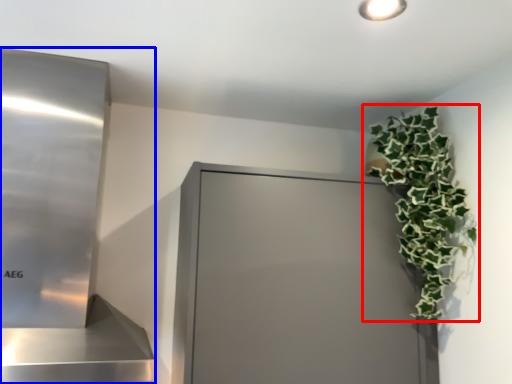
Question: Which point is closer to the camera, houseplant (highlighted by a red box) or appliance (highlighted by a blue box)?

Choices:
 (A) houseplant
 (B) appliance

Answer: (B)